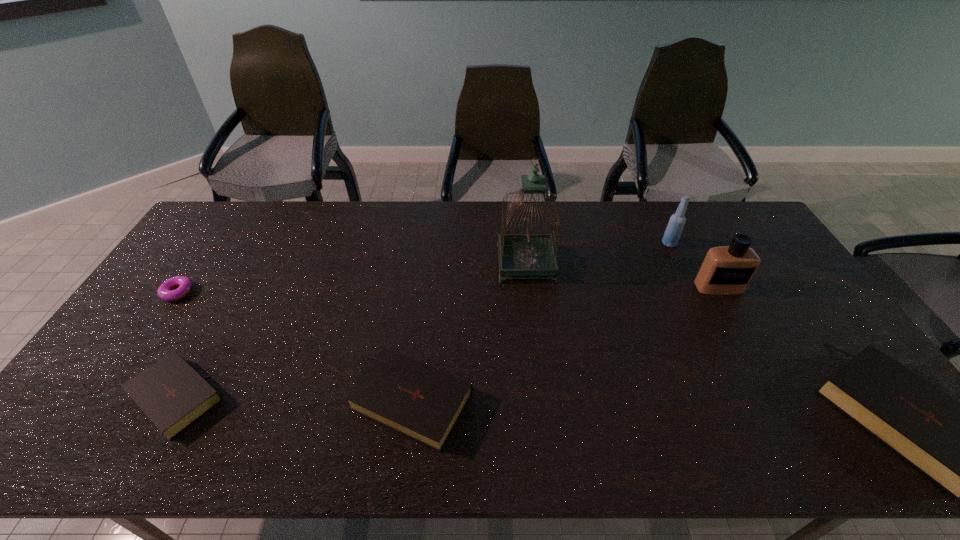
Locate an element on the screen. This screenshot has height=540, width=960. free space between the perfume and the bottle is located at coordinates coord(694,265).

The height and width of the screenshot is (540, 960). In order to click on vacant point located between the second tallest Bible and the birdcage in this screenshot , I will do `click(469, 332)`.

This screenshot has height=540, width=960. In order to click on empty space between the bottle and the perfume in this screenshot , I will do `click(694, 265)`.

At what (x,y) coordinates should I click in order to perform the action: click on free space between the fifth tallest object and the tallest object. Please return your answer as a coordinate pair (x, y). Image resolution: width=960 pixels, height=540 pixels. Looking at the image, I should click on (469, 332).

At what (x,y) coordinates should I click in order to perform the action: click on the fifth closest object relative to the second tallest Bible. Please return your answer as a coordinate pair (x, y). The height and width of the screenshot is (540, 960). Looking at the image, I should click on (673, 231).

Identify which object is the closest to the bottle. Please provide its 2D coordinates. Your answer should be formatted as a tuple, i.e. [(x, y)], where the tuple contains the x and y coordinates of a point satisfying the conditions above.

[(726, 270)]

Where is `Bible that stands as the second closest to the leftmost Bible`? Bible that stands as the second closest to the leftmost Bible is located at coordinates (959, 446).

Identify which Bible is the second nearest to the fifth object from right to left. Please provide its 2D coordinates. Your answer should be formatted as a tuple, i.e. [(x, y)], where the tuple contains the x and y coordinates of a point satisfying the conditions above.

[(959, 446)]

Identify the location of free space that satisfies the following two spatial constraints: 1. on the front side of the shortest object; 2. on the left side of the fifth object from right to left. This screenshot has height=540, width=960. (105, 400).

At what (x,y) coordinates should I click in order to perform the action: click on free space that satisfies the following two spatial constraints: 1. on the back side of the second Bible from right to left; 2. on the left side of the bottle. Please return your answer as a coordinate pair (x, y). Looking at the image, I should click on (431, 244).